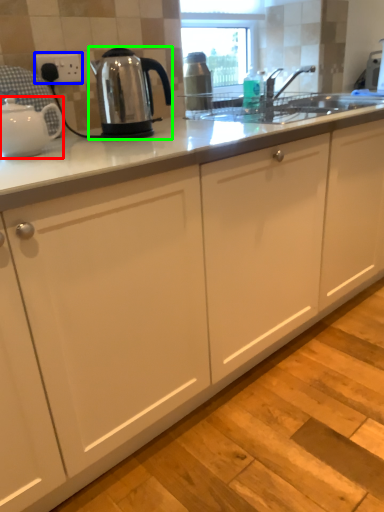
Question: Which object is positioned farthest from kettle (highlighted by a red box)? Select from electric outlet (highlighted by a blue box) and kettle (highlighted by a green box).

Choices:
 (A) electric outlet
 (B) kettle

Answer: (A)